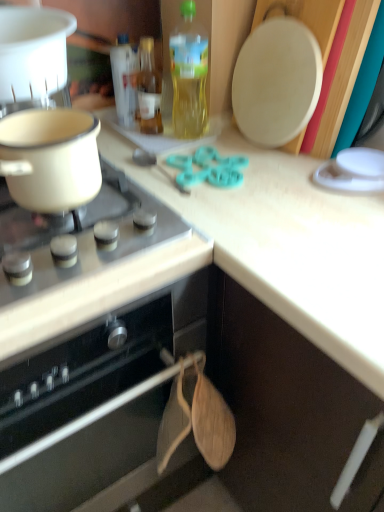
Locate an element on the screen. translucent glass bottle at upper center, which ranks as the second bottle in left-to-right order is located at coordinates (149, 89).

Describe the element at coordinates (99, 366) in the screenshot. I see `black matte oven at lower left` at that location.

What do you see at coordinates (124, 78) in the screenshot? I see `translucent plastic bottle at upper center, positioned as the third bottle in right-to-left order` at bounding box center [124, 78].

At what (x,y) coordinates should I click in order to perform the action: click on matte white pot at left, acting as the 1th kitchen appliance starting from the bottom. Please return your answer as a coordinate pair (x, y). The height and width of the screenshot is (512, 384). Looking at the image, I should click on (50, 158).

In order to face matte white pot at left, which is the 2th kitchen appliance in top-to-bottom order, should I rotate leftwards or rightwards?

To align with it, rotate left about 18.595°.

I want to click on translucent yellow bottle at upper center, the third bottle viewed from the left, so (189, 74).

What is the approximate height of white glossy gas stove at upper left?

white glossy gas stove at upper left is 2.94 inches in height.

The width and height of the screenshot is (384, 512). What are the coordinates of `translucent glass bottle at upper center, the second bottle in the right-to-left sequence` in the screenshot? It's located at (149, 89).

From the image's perspective, between translucent plastic bottle at upper center, the 1th bottle positioned from the left, and translucent glass bottle at upper center, the second bottle in the right-to-left sequence, who is located below?

translucent glass bottle at upper center, the second bottle in the right-to-left sequence.

Is translucent plastic bottle at upper center, the 1th bottle positioned from the left, next to translucent glass bottle at upper center, the second bottle in the right-to-left sequence?

Yes, translucent plastic bottle at upper center, the 1th bottle positioned from the left, is right next to translucent glass bottle at upper center, the second bottle in the right-to-left sequence, and making contact.

Which object is positioned more to the left, translucent plastic bottle at upper center, the 1th bottle positioned from the left, or translucent glass bottle at upper center, which ranks as the second bottle in left-to-right order?

translucent plastic bottle at upper center, the 1th bottle positioned from the left.

Between translucent glass bottle at upper center, the second bottle in the right-to-left sequence, and white plastic pot at upper left, the 1th kitchen appliance when ordered from top to bottom, which one has larger width?

Wider between the two is white plastic pot at upper left, the 1th kitchen appliance when ordered from top to bottom.

Is translucent glass bottle at upper center, which ranks as the second bottle in left-to-right order, with white plastic pot at upper left, the 1th kitchen appliance when ordered from top to bottom?

No, translucent glass bottle at upper center, which ranks as the second bottle in left-to-right order, is not next to white plastic pot at upper left, the 1th kitchen appliance when ordered from top to bottom.

How different are the orientations of translucent glass bottle at upper center, which ranks as the second bottle in left-to-right order, and white plastic pot at upper left, which is the second kitchen appliance from bottom to top, in degrees?

There is a 0.00599-degree angle between the facing directions of translucent glass bottle at upper center, which ranks as the second bottle in left-to-right order, and white plastic pot at upper left, which is the second kitchen appliance from bottom to top.

Are matte white pot at left, acting as the 1th kitchen appliance starting from the bottom, and black matte oven at lower left beside each other?

matte white pot at left, acting as the 1th kitchen appliance starting from the bottom, and black matte oven at lower left are clearly separated.

Does point (13, 160) come closer to viewer compared to point (123, 390)?

Yes, it is.

Which object is positioned more to the left, matte white pot at left, which is the 2th kitchen appliance in top-to-bottom order, or black matte oven at lower left?

Positioned to the left is black matte oven at lower left.

Locate an element on the screen. oven to the left of matte white pot at left, acting as the 1th kitchen appliance starting from the bottom is located at coordinates (99, 366).

From a real-world perspective, is black matte oven at lower left located higher than white glossy gas stove at upper left?

No.

From the image's perspective, is black matte oven at lower left under white glossy gas stove at upper left?

Yes, from the image's perspective, black matte oven at lower left is beneath white glossy gas stove at upper left.

Is black matte oven at lower left oriented towards white glossy gas stove at upper left?

No, black matte oven at lower left is not facing towards white glossy gas stove at upper left.

Between black matte oven at lower left and white glossy gas stove at upper left, which one is positioned behind?

white glossy gas stove at upper left is behind.

Is point (149, 393) positioned after point (173, 87)?

No, it is not.

Is translucent yellow bottle at upper center, the first bottle in the right-to-left sequence, completely or partially inside black matte oven at lower left?

No.

From the image's perspective, is black matte oven at lower left on translucent yellow bottle at upper center, the first bottle in the right-to-left sequence?

No, from the image's perspective, black matte oven at lower left is not over translucent yellow bottle at upper center, the first bottle in the right-to-left sequence.

Is translucent glass bottle at upper center, the second bottle in the right-to-left sequence, situated inside black matte oven at lower left or outside?

translucent glass bottle at upper center, the second bottle in the right-to-left sequence, lies outside black matte oven at lower left.

How distant is translucent glass bottle at upper center, the second bottle in the right-to-left sequence, from black matte oven at lower left?

A distance of 25.38 inches exists between translucent glass bottle at upper center, the second bottle in the right-to-left sequence, and black matte oven at lower left.

In the scene shown: Are translucent glass bottle at upper center, the second bottle in the right-to-left sequence, and black matte oven at lower left beside each other?

No, translucent glass bottle at upper center, the second bottle in the right-to-left sequence, is not in contact with black matte oven at lower left.

From a real-world perspective, is translucent glass bottle at upper center, which ranks as the second bottle in left-to-right order, physically above black matte oven at lower left?

Yes, from a real-world perspective, translucent glass bottle at upper center, which ranks as the second bottle in left-to-right order, is above black matte oven at lower left.

Is translucent plastic bottle at upper center, positioned as the third bottle in right-to-left order, at the back of translucent yellow bottle at upper center, the third bottle viewed from the left?

translucent yellow bottle at upper center, the third bottle viewed from the left, does not have its back to translucent plastic bottle at upper center, positioned as the third bottle in right-to-left order.

Considering the positions of point (175, 102) and point (123, 112), is point (175, 102) closer or farther from the camera than point (123, 112)?

Point (175, 102) is farther from the camera than point (123, 112).

Which bottle is the 2nd one when counting from the front of the translucent plastic bottle at upper center, the 1th bottle positioned from the left? Please provide its 2D coordinates.

[(189, 74)]

Image resolution: width=384 pixels, height=512 pixels. In order to click on bottle below the translucent plastic bottle at upper center, positioned as the third bottle in right-to-left order (from the image's perspective) in this screenshot , I will do `click(149, 89)`.

From a real-world perspective, which bottle is the 3rd one underneath the white plastic pot at upper left, the 1th kitchen appliance when ordered from top to bottom? Please provide its 2D coordinates.

[(149, 89)]

When comparing their distances from translucent glass bottle at upper center, the second bottle in the right-to-left sequence, does matte white pot at left, which is the 2th kitchen appliance in top-to-bottom order, or black matte oven at lower left seem closer?

Among the two, matte white pot at left, which is the 2th kitchen appliance in top-to-bottom order, is located nearer to translucent glass bottle at upper center, the second bottle in the right-to-left sequence.

Looking at the image, which one is located closer to black matte oven at lower left, matte white pot at left, acting as the 1th kitchen appliance starting from the bottom, or white glossy gas stove at upper left?

white glossy gas stove at upper left is positioned closer to the anchor black matte oven at lower left.

Looking at the image, which one is located closer to translucent yellow bottle at upper center, the third bottle viewed from the left, white glossy gas stove at upper left or black matte oven at lower left?

The object closer to translucent yellow bottle at upper center, the third bottle viewed from the left, is white glossy gas stove at upper left.

Considering their positions, is translucent plastic bottle at upper center, positioned as the third bottle in right-to-left order, positioned further to black matte oven at lower left than white glossy gas stove at upper left?

translucent plastic bottle at upper center, positioned as the third bottle in right-to-left order.

Estimate the real-world distances between objects in this image. Which object is further from translucent glass bottle at upper center, which ranks as the second bottle in left-to-right order, translucent plastic bottle at upper center, the 1th bottle positioned from the left, or matte white pot at left, which is the 2th kitchen appliance in top-to-bottom order?

matte white pot at left, which is the 2th kitchen appliance in top-to-bottom order, lies further to translucent glass bottle at upper center, which ranks as the second bottle in left-to-right order, than the other object.

When comparing their distances from translucent plastic bottle at upper center, positioned as the third bottle in right-to-left order, does white plastic pot at upper left, which is the second kitchen appliance from bottom to top, or matte white pot at left, acting as the 1th kitchen appliance starting from the bottom, seem further?

matte white pot at left, acting as the 1th kitchen appliance starting from the bottom, lies further to translucent plastic bottle at upper center, positioned as the third bottle in right-to-left order, than the other object.

Looking at the image, which one is located closer to black matte oven at lower left, white glossy gas stove at upper left or white plastic pot at upper left, the 1th kitchen appliance when ordered from top to bottom?

white glossy gas stove at upper left.

From the image, which object appears to be nearer to matte white pot at left, acting as the 1th kitchen appliance starting from the bottom, translucent glass bottle at upper center, which ranks as the second bottle in left-to-right order, or black matte oven at lower left?

Based on the image, black matte oven at lower left appears to be nearer to matte white pot at left, acting as the 1th kitchen appliance starting from the bottom.

The width and height of the screenshot is (384, 512). What are the coordinates of `gas stove between translucent glass bottle at upper center, the second bottle in the right-to-left sequence, and black matte oven at lower left in the up-down direction` in the screenshot? It's located at pos(84,233).

At what (x,y) coordinates should I click in order to perform the action: click on kitchen appliance between white plastic pot at upper left, the 1th kitchen appliance when ordered from top to bottom, and black matte oven at lower left from top to bottom. Please return your answer as a coordinate pair (x, y). Looking at the image, I should click on (50, 158).

You are a GUI agent. You are given a task and a screenshot of the screen. Output one action in this format:
    pyautogui.click(x=<x>, y=<y>)
    Task: Click on the bottle that lies between translucent plastic bottle at upper center, positioned as the third bottle in right-to-left order, and black matte oven at lower left from top to bottom
    The image size is (384, 512).
    Given the screenshot: What is the action you would take?
    pyautogui.click(x=149, y=89)

Find the location of a particular element. The height and width of the screenshot is (512, 384). bottle situated between translucent plastic bottle at upper center, positioned as the third bottle in right-to-left order, and translucent yellow bottle at upper center, the third bottle viewed from the left, from left to right is located at coordinates (149, 89).